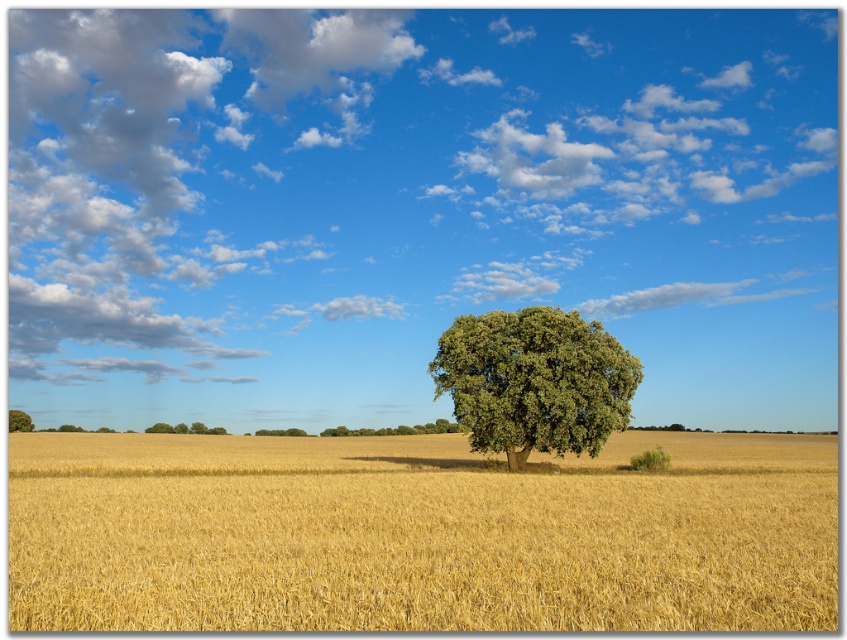
You are an artist planning to paint this rural landscape. You want to ensure the green leafy tree at center is proportionally smaller than the golden matte wheat field at center in your painting. Does the current scene support this requirement?

Yes, the golden matte wheat field at center is bigger than the green leafy tree at center, so the scene supports the requirement to depict the tree as proportionally smaller.